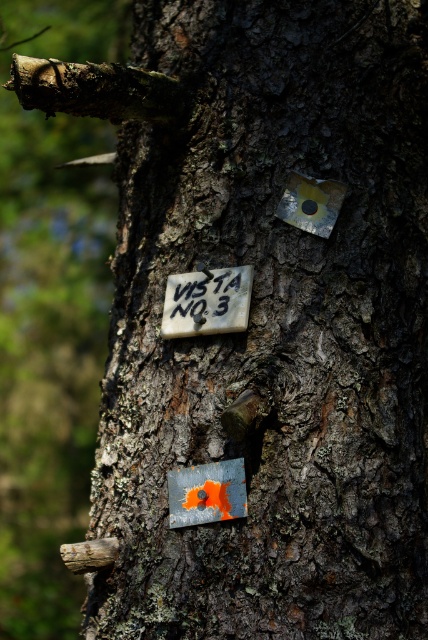
Question: Does white paper at center appear on the right side of orange painted metal sign at center?

Choices:
 (A) no
 (B) yes

Answer: (A)

Question: In this image, where is white paper at center located relative to orange painted metal sign at center?

Choices:
 (A) left
 (B) right

Answer: (A)

Question: Can you confirm if white paper at center is smaller than orange painted metal sign at center?

Choices:
 (A) yes
 (B) no

Answer: (B)

Question: Which point is farther from the camera taking this photo?

Choices:
 (A) (241, 291)
 (B) (202, 477)

Answer: (A)